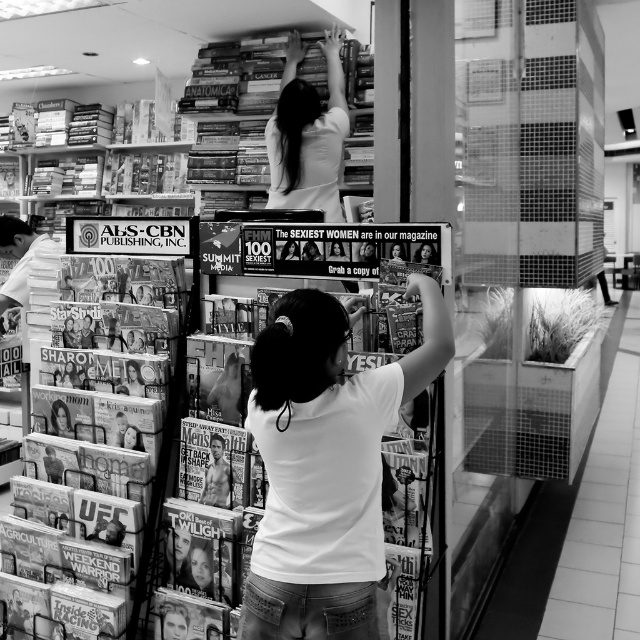
You are a customer in the bookstore and want to pick up the smooth glossy magazine at center. There is a person wearing a white matte shirt at upper center blocking your view. Can you reach the magazine without moving the person?

The white matte shirt at upper center is further to the viewer than the smooth glossy magazine at center, so the person is closer to you. This means the person is blocking your direct access to the magazine, making it impossible to reach it without moving them.

Looking at this image, you are a customer in the bookstore and want to reach both the hardcover books at upper left and the matte glossy magazines at lower left. Which item is closer to you?

The hardcover books at upper left are closer to you than the matte glossy magazines at lower left because the magazines are positioned behind the books.

You are standing in the bookstore and want to place a new magazine rack at the exact center of the room. According to the image, where should you avoid placing the rack to not block the white matte shirt at center?

You should avoid placing the magazine rack at the coordinates point (324, 465) where the white matte shirt at center is located.